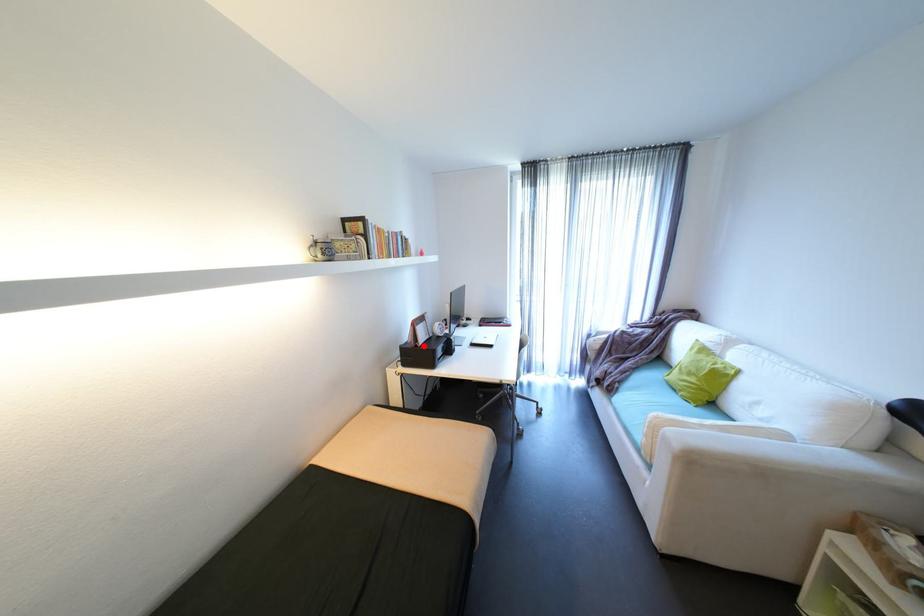
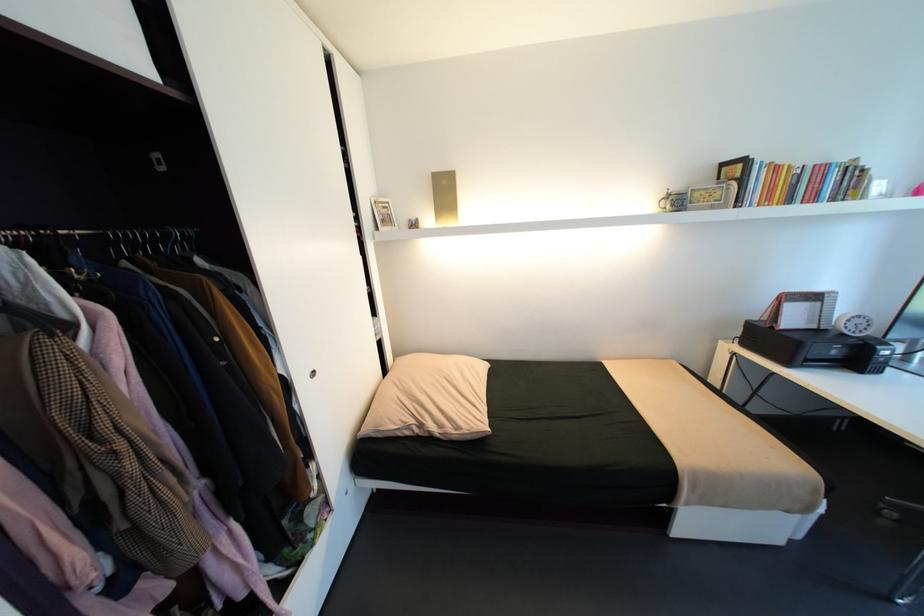
Find the pixel in the second image that matches the highlighted location in the first image.

(779, 328)